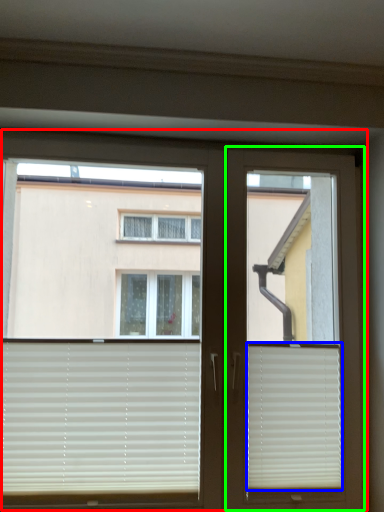
Question: Based on their relative distances, which object is nearer to window (highlighted by a red box)? Choose from window blind (highlighted by a blue box) and screen door (highlighted by a green box).

Choices:
 (A) window blind
 (B) screen door

Answer: (B)